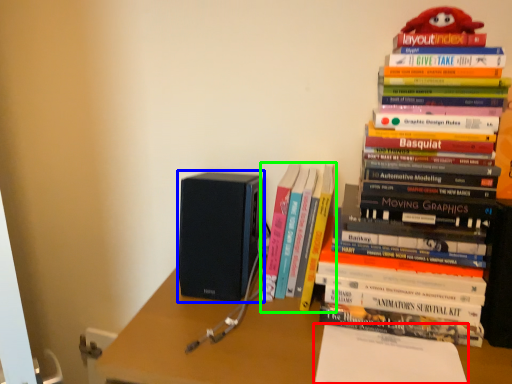
Question: Estimate the real-world distances between objects in this image. Which object is farther from paperback book (highlighted by a red box), speaker (highlighted by a blue box) or book (highlighted by a green box)?

Choices:
 (A) speaker
 (B) book

Answer: (A)